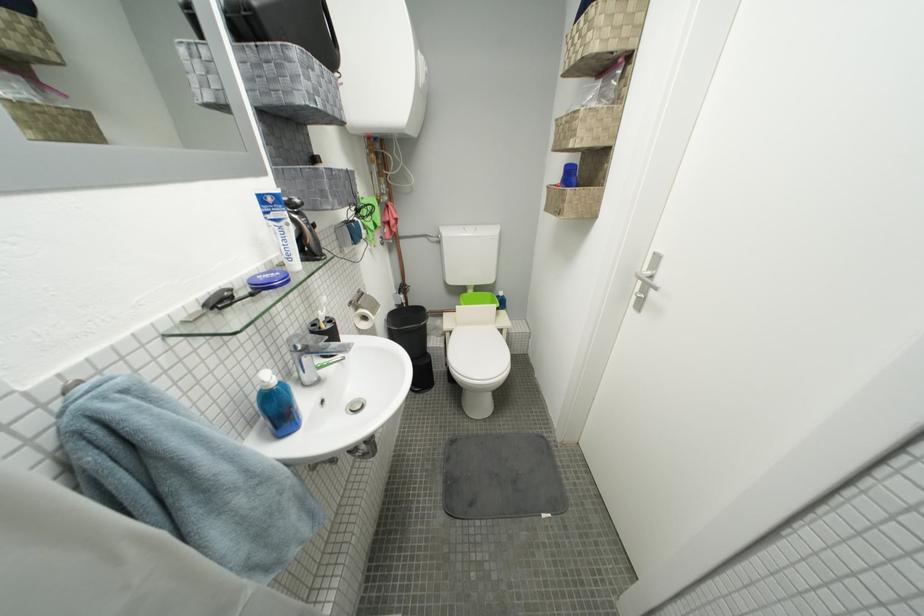
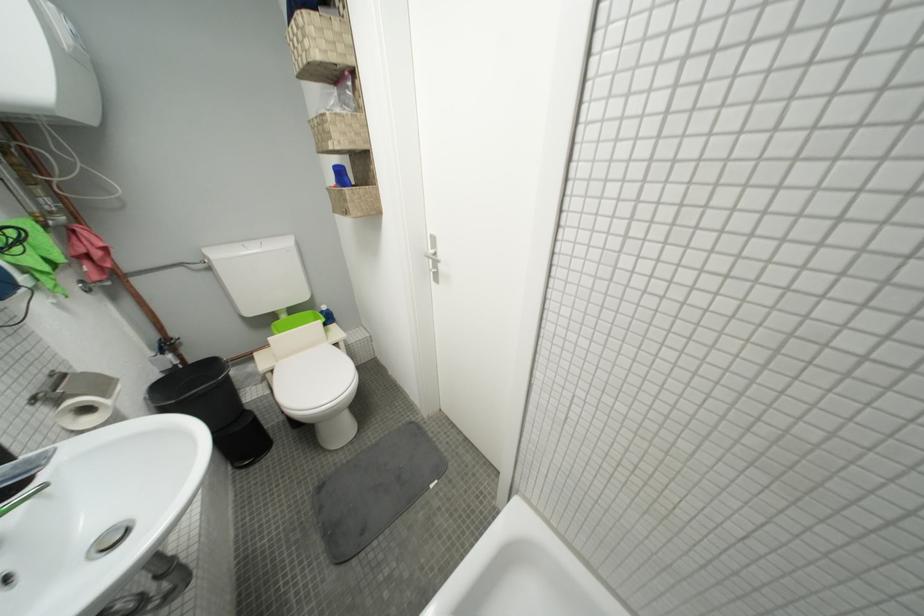
Locate, in the second image, the point that corresponds to point 411,292 in the first image.

(175, 347)